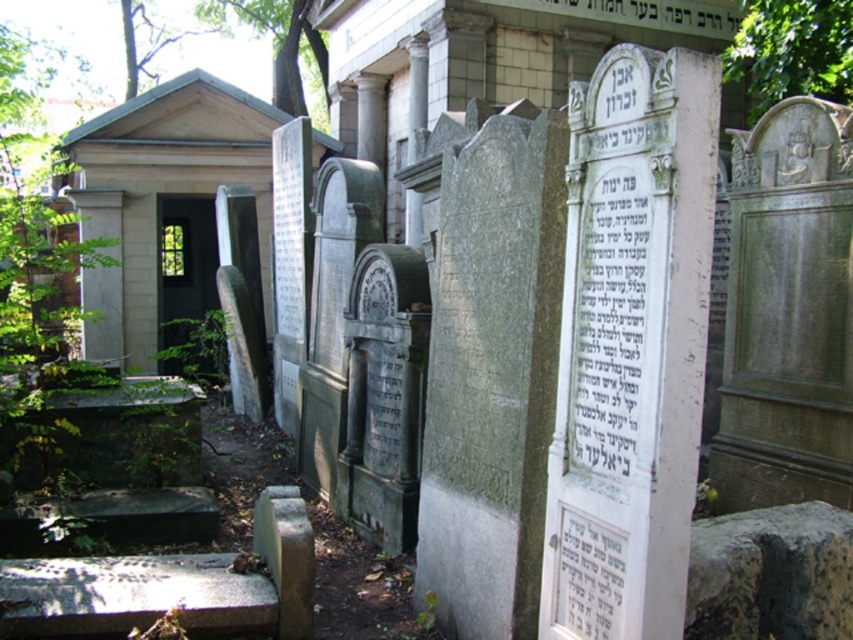
You are standing in a Jewish cemetery and see two tombstones in front of you. The gray stone tombstone at center and the smooth stone tombstone at center. Which tombstone is positioned to the right of the other?

The gray stone tombstone at center is to the right of the smooth stone tombstone at center.

You are standing in a Jewish cemetery and see the white stone gravestone at center and the smooth stone tombstone at center. Which one is positioned more to the east side?

The white stone gravestone at center is to the right of the smooth stone tombstone at center. Since the smooth stone tombstone at center is positioned to the west, the white stone gravestone at center would be more to the east side.

You are standing in front of the gray stone tombstone at center and the smooth stone tombstone at center in the cemetery. Which tombstone is closer to you?

The gray stone tombstone at center is closer to the viewer than the smooth stone tombstone at center.